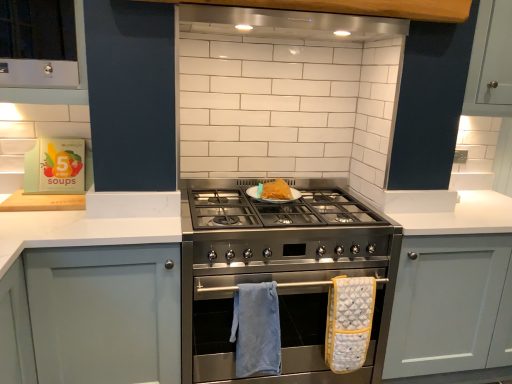
Question: Is the position of white matte cabinet at left, which is the second cabinetry in right-to-left order, more distant than that of matte gray cabinet at center, which is counted as the 1th cabinetry, starting from the right?

Choices:
 (A) yes
 (B) no

Answer: (B)

Question: Would you say white matte cabinet at left, which is the second cabinetry in right-to-left order, contains matte gray cabinet at center, which is counted as the 1th cabinetry, starting from the right?

Choices:
 (A) yes
 (B) no

Answer: (B)

Question: Is white matte cabinet at left, which is the second cabinetry in right-to-left order, not close to matte gray cabinet at center, which is counted as the 1th cabinetry, starting from the right?

Choices:
 (A) no
 (B) yes

Answer: (B)

Question: Can you confirm if white matte cabinet at left, which is the 1th cabinetry in left-to-right order, is positioned to the right of matte gray cabinet at center, which is counted as the 1th cabinetry, starting from the right?

Choices:
 (A) no
 (B) yes

Answer: (A)

Question: Considering the relative sizes of white matte cabinet at left, which is the 1th cabinetry in left-to-right order, and matte gray cabinet at center, marked as the 2th cabinetry in a left-to-right arrangement, in the image provided, is white matte cabinet at left, which is the 1th cabinetry in left-to-right order, bigger than matte gray cabinet at center, marked as the 2th cabinetry in a left-to-right arrangement,?

Choices:
 (A) no
 (B) yes

Answer: (A)

Question: Which is correct: yellow quilted oven mitt at center, which is the second bath towel from left to right, is inside matte gray cabinet at center, which is counted as the 1th cabinetry, starting from the right, or outside of it?

Choices:
 (A) inside
 (B) outside

Answer: (B)

Question: In terms of height, does yellow quilted oven mitt at center, which is the second bath towel from left to right, look taller or shorter compared to matte gray cabinet at center, marked as the 2th cabinetry in a left-to-right arrangement?

Choices:
 (A) short
 (B) tall

Answer: (A)

Question: Is point pyautogui.click(x=340, y=322) positioned closer to the camera than point pyautogui.click(x=391, y=344)?

Choices:
 (A) farther
 (B) closer

Answer: (B)

Question: Relative to matte gray cabinet at center, marked as the 2th cabinetry in a left-to-right arrangement, is yellow quilted oven mitt at center, marked as the 1th bath towel in a right-to-left arrangement, in front or behind?

Choices:
 (A) behind
 (B) front

Answer: (B)

Question: Is stainless steel stove at center spatially inside golden brown pastry at center, or outside of it?

Choices:
 (A) outside
 (B) inside

Answer: (A)

Question: Is point (x=352, y=248) positioned closer to the camera than point (x=288, y=193)?

Choices:
 (A) closer
 (B) farther

Answer: (A)

Question: Is stainless steel stove at center wider or thinner than golden brown pastry at center?

Choices:
 (A) thin
 (B) wide

Answer: (B)

Question: Based on their positions, is stainless steel stove at center located to the left or right of golden brown pastry at center?

Choices:
 (A) left
 (B) right

Answer: (A)

Question: Is point (263, 334) closer or farther from the camera than point (467, 253)?

Choices:
 (A) farther
 (B) closer

Answer: (B)

Question: Considering the positions of blue soft towel at lower center, the first bath towel from the left, and matte gray cabinet at center, which is counted as the 1th cabinetry, starting from the right, in the image, is blue soft towel at lower center, the first bath towel from the left, taller or shorter than matte gray cabinet at center, which is counted as the 1th cabinetry, starting from the right,?

Choices:
 (A) tall
 (B) short

Answer: (B)